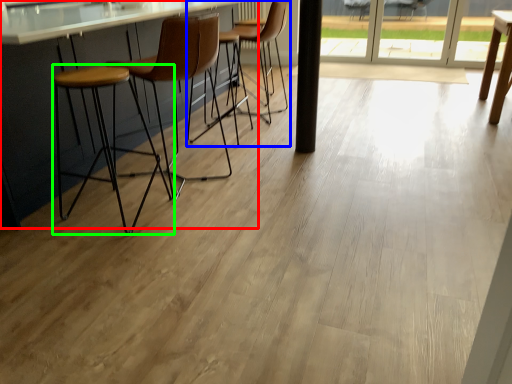
Question: Which object is positioned closest to counter (highlighted by a red box)? Select from chair (highlighted by a blue box) and stool (highlighted by a green box).

Choices:
 (A) chair
 (B) stool

Answer: (B)